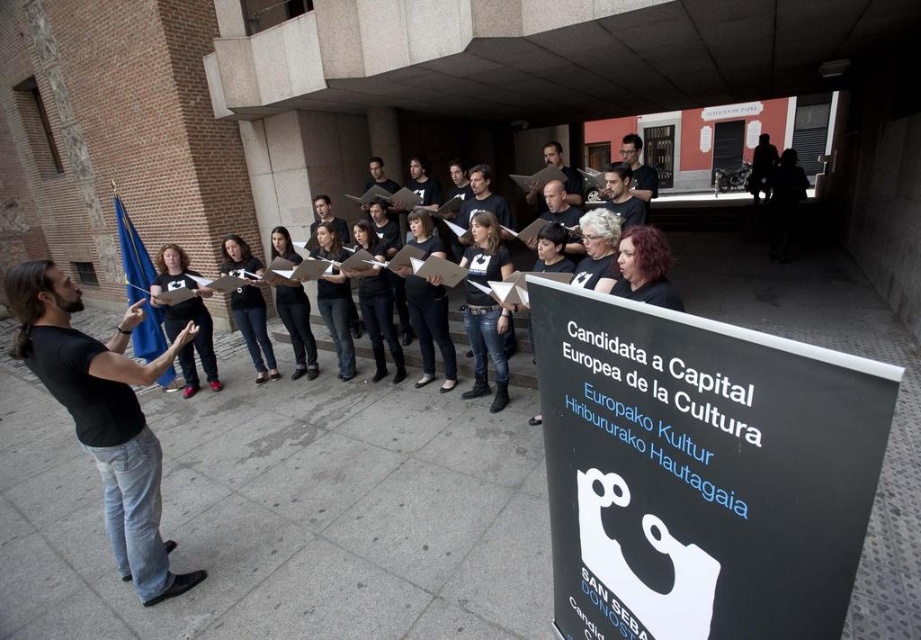
You are standing in the middle of the choir formation. You want to locate the black matte sign at lower right. Which direction should you turn to face it?

Since the black matte sign at lower right is located at point [701,472], you should turn to your right to face it as it is positioned to the lower right from your current position in the middle of the choir formation.